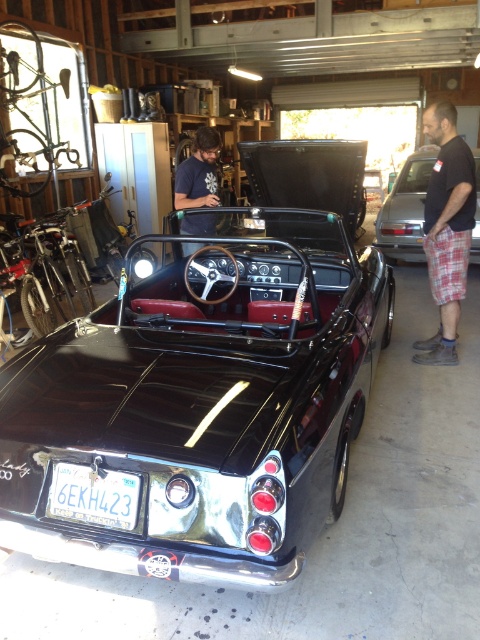
Is point (434, 337) positioned after point (213, 230)?

No, (434, 337) is in front of (213, 230).

Looking at this image, can you confirm if black cotton t-shirt at right is shorter than dark blue t-shirt at center?

No, black cotton t-shirt at right is not shorter than dark blue t-shirt at center.

Between point (431, 259) and point (208, 138), which one is positioned behind?

Point (208, 138)

What are the coordinates of `black cotton t-shirt at right` in the screenshot? It's located at (446, 228).

Between white plastic license plate at lower center and dark blue t-shirt at center, which one has more height?

dark blue t-shirt at center is taller.

The image size is (480, 640). What do you see at coordinates (95, 493) in the screenshot?
I see `white plastic license plate at lower center` at bounding box center [95, 493].

Image resolution: width=480 pixels, height=640 pixels. Identify the location of white plastic license plate at lower center. (95, 493).

Is the position of white plastic license plate at lower center less distant than that of glossy black convertible at right?

Yes, white plastic license plate at lower center is closer to the viewer.

Can you confirm if white plastic license plate at lower center is positioned below glossy black convertible at right?

Indeed, white plastic license plate at lower center is positioned under glossy black convertible at right.

Measure the distance between white plastic license plate at lower center and camera.

white plastic license plate at lower center is 1.98 meters from camera.

The image size is (480, 640). Find the location of `white plastic license plate at lower center`. white plastic license plate at lower center is located at coordinates pos(95,493).